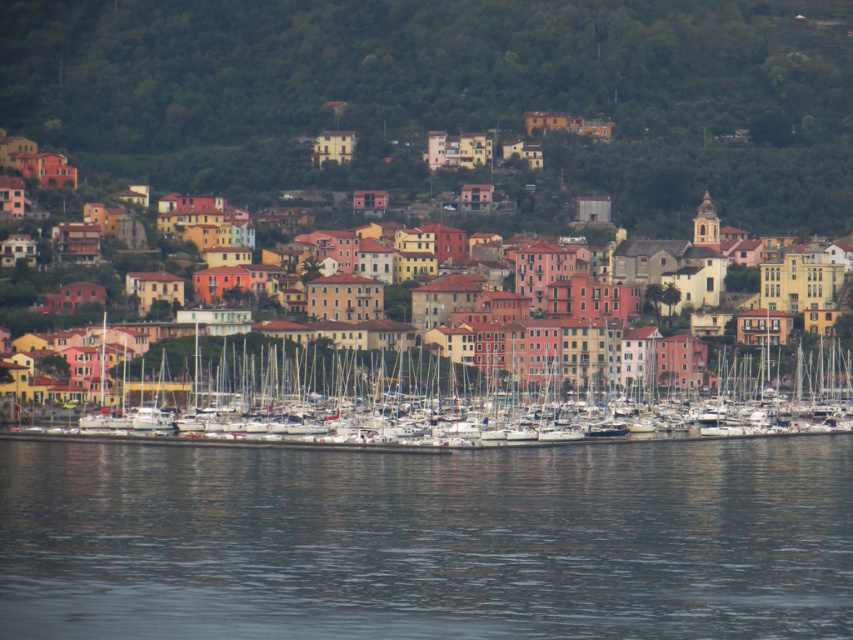
Question: Can you confirm if dark gray water at lower center is positioned to the right of white matte boats at center?

Choices:
 (A) yes
 (B) no

Answer: (B)

Question: Does dark gray water at lower center have a lesser width compared to multicolored buildings at center?

Choices:
 (A) yes
 (B) no

Answer: (B)

Question: Estimate the real-world distances between objects in this image. Which object is farther from the dark gray water at lower center?

Choices:
 (A) multicolored buildings at center
 (B) white matte boats at center

Answer: (A)

Question: Is dark gray water at lower center below white matte boats at center?

Choices:
 (A) no
 (B) yes

Answer: (B)

Question: Which point is farther to the camera?

Choices:
 (A) dark gray water at lower center
 (B) white matte boats at center

Answer: (A)

Question: Which object is the closest to the dark gray water at lower center?

Choices:
 (A) multicolored buildings at center
 (B) white matte boats at center

Answer: (B)